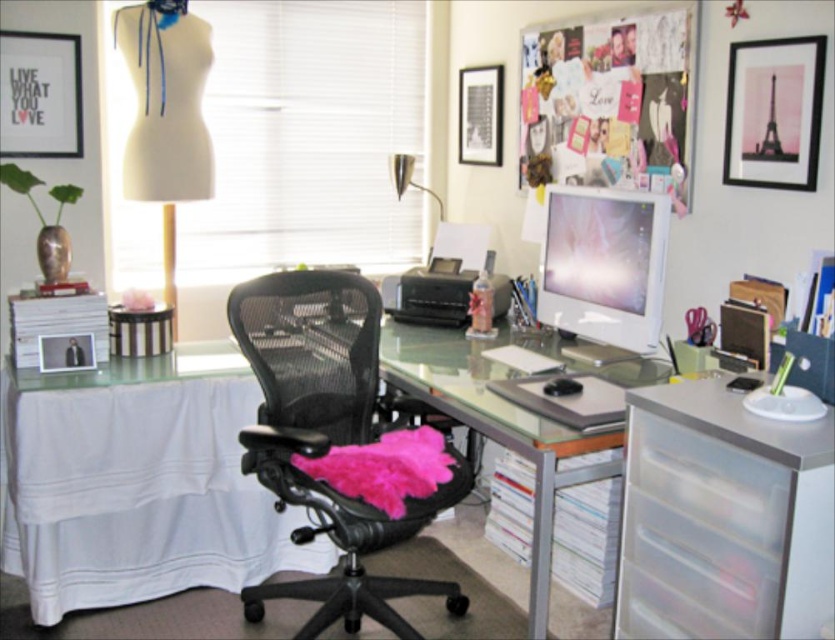
Question: Among these points, which one is farthest from the camera?

Choices:
 (A) (666, 492)
 (B) (424, 307)
 (C) (352, 312)

Answer: (B)

Question: Is clear glass desk at center bigger than white glossy computer monitor at center?

Choices:
 (A) yes
 (B) no

Answer: (A)

Question: Is black mesh swivel chair at center bigger than black plastic printer at center?

Choices:
 (A) no
 (B) yes

Answer: (B)

Question: Among these objects, which one is nearest to the camera?

Choices:
 (A) black mesh swivel chair at center
 (B) clear glass desk at center
 (C) white glossy computer monitor at center

Answer: (B)

Question: Does clear plastic drawers at right appear over clear glass desk at center?

Choices:
 (A) no
 (B) yes

Answer: (A)

Question: Which of the following is the farthest from the observer?

Choices:
 (A) clear plastic drawers at right
 (B) white glossy computer monitor at center
 (C) transparent plastic drawer at lower right
 (D) black plastic printer at center

Answer: (D)